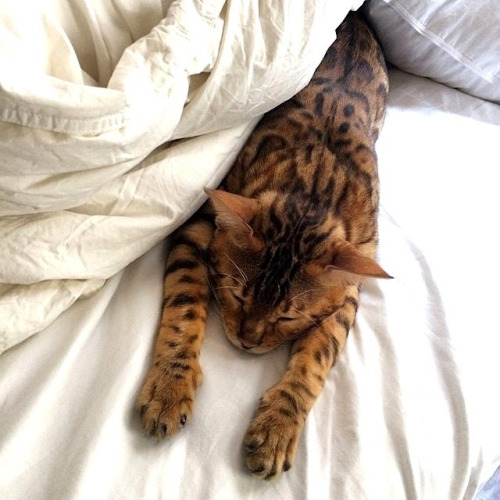
The height and width of the screenshot is (500, 500). I want to click on comforter, so click(x=129, y=95).